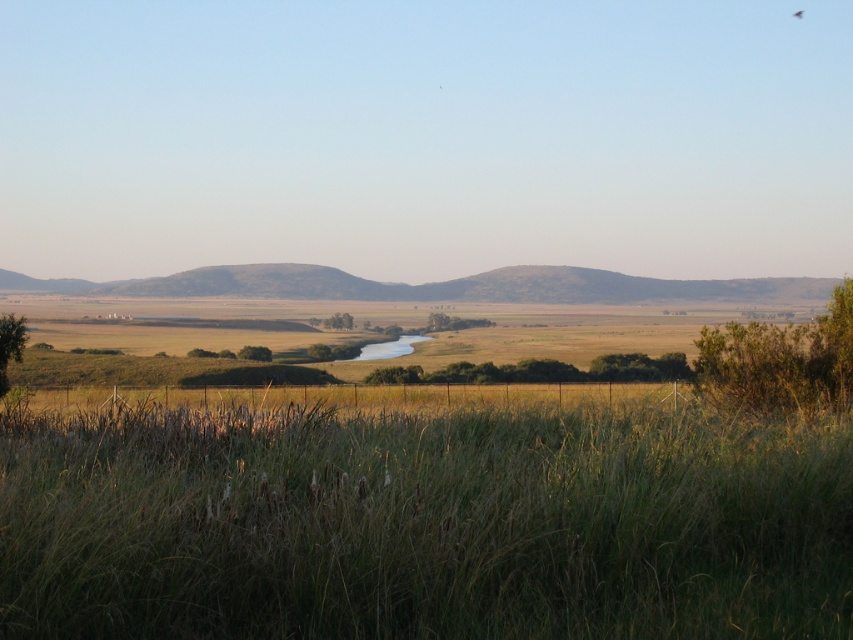
Can you confirm if green leafy shrub at center is smaller than green leafy tree at lower left?

No.

Is green leafy shrub at center to the right of green leafy tree at lower left from the viewer's perspective?

Yes, green leafy shrub at center is to the right of green leafy tree at lower left.

Looking at this image, who is more forward, (x=540, y=372) or (x=6, y=342)?

Positioned in front is point (x=6, y=342).

At what (x,y) coordinates should I click in order to perform the action: click on green leafy shrub at center. Please return your answer as a coordinate pair (x, y). This screenshot has height=640, width=853. Looking at the image, I should click on (544, 371).

Who is taller, green grassy at lower center or green leafy tree at lower left?

With more height is green leafy tree at lower left.

Looking at this image, between green grassy at lower center and green leafy tree at lower left, which one appears on the right side from the viewer's perspective?

green grassy at lower center

Does point (171, 486) come closer to viewer compared to point (13, 349)?

Yes, it is.

Identify the location of green grassy at lower center. (422, 524).

Who is positioned more to the left, green leafy bush at upper right or green matte tree at center?

From the viewer's perspective, green matte tree at center appears more on the left side.

Between point (779, 336) and point (338, 317), which one is positioned in front?

Point (779, 336)

Where is `green leafy bush at upper right`? The image size is (853, 640). green leafy bush at upper right is located at coordinates (780, 362).